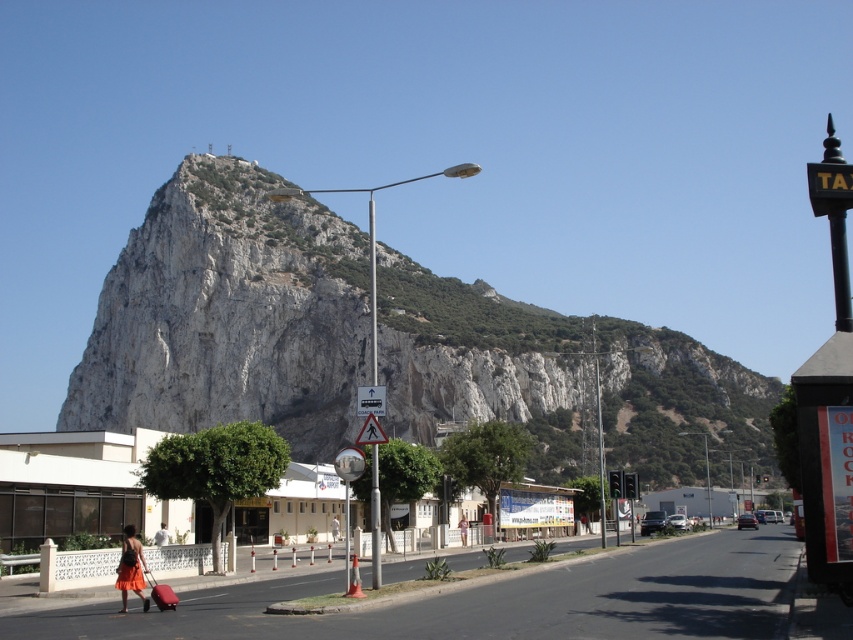
You are a photographer standing on the sidewalk, wanting to take a photo that includes both the white rocky mountain at upper center and the orange fabric skirt at lower left. Which object should you focus on first to ensure both are in focus?

You should focus on the orange fabric skirt at lower left first because it is closer to you than the white rocky mountain at upper center, which is further away. By focusing on the closer object, the mountain will still be in focus due to the depth of field.